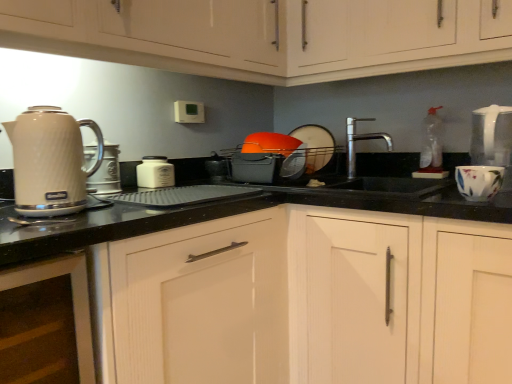
Describe the element at coordinates (183, 195) in the screenshot. I see `black plastic tray at center, acting as the 1th appliance starting from the bottom` at that location.

Find the location of `matte white cabinets at upper left, marked as the first cabinetry in a top-to-bottom arrangement`. matte white cabinets at upper left, marked as the first cabinetry in a top-to-bottom arrangement is located at coordinates (156, 34).

What is the approximate height of polished stainless steel faucet at center?

It is 10.14 inches.

At what (x,y) coordinates should I click in order to perform the action: click on white wood cabinet at center, the 4th cabinetry when ordered from top to bottom. Please return your answer as a coordinate pair (x, y). The image size is (512, 384). Looking at the image, I should click on (306, 300).

Find the location of a particular element. metallic silver toaster at left, which appears as the 1th kitchen appliance when viewed from the front is located at coordinates (106, 173).

Where is `black plastic tray at center, which is the first appliance in front-to-back order`? This screenshot has width=512, height=384. black plastic tray at center, which is the first appliance in front-to-back order is located at coordinates (183, 195).

From a real-world perspective, is black plastic tray at center, which is counted as the 2th appliance, starting from the back, physically below matte white cabinet at upper center, the second cabinetry viewed from the top?

Yes, from a real-world perspective, black plastic tray at center, which is counted as the 2th appliance, starting from the back, is under matte white cabinet at upper center, the second cabinetry viewed from the top.

Is black plastic tray at center, arranged as the second appliance when viewed from the top, completely or partially outside of matte white cabinet at upper center, the third cabinetry from the bottom?

That's correct, black plastic tray at center, arranged as the second appliance when viewed from the top, is outside of matte white cabinet at upper center, the third cabinetry from the bottom.

How different are the orientations of black plastic tray at center, which appears as the 1th appliance when viewed from the left, and matte white cabinet at upper center, the second cabinetry viewed from the top, in degrees?

The facing directions of black plastic tray at center, which appears as the 1th appliance when viewed from the left, and matte white cabinet at upper center, the second cabinetry viewed from the top, are 3.27 degrees apart.

Which is more to the left, black plastic tray at center, acting as the 1th appliance starting from the bottom, or matte white cabinet at upper center, the third cabinetry from the bottom?

Positioned to the left is black plastic tray at center, acting as the 1th appliance starting from the bottom.

Is there a large distance between white matte jar at center, the 2th kitchen appliance when ordered from front to back, and white wood cabinet at center, the 4th cabinetry when ordered from top to bottom?

No, white matte jar at center, the 2th kitchen appliance when ordered from front to back, is in close proximity to white wood cabinet at center, the 4th cabinetry when ordered from top to bottom.

What's the angular difference between white matte jar at center, the first kitchen appliance when ordered from back to front, and white wood cabinet at center, the 4th cabinetry when ordered from top to bottom,'s facing directions?

The angle between the facing direction of white matte jar at center, the first kitchen appliance when ordered from back to front, and the facing direction of white wood cabinet at center, the 4th cabinetry when ordered from top to bottom, is 88.9 degrees.

From a real-world perspective, which is physically below, white matte jar at center, the first kitchen appliance when ordered from back to front, or white wood cabinet at center, placed as the 1th cabinetry when sorted from bottom to top?

white wood cabinet at center, placed as the 1th cabinetry when sorted from bottom to top, from a real-world perspective.

Could you measure the distance between white matte jar at center, which is the 2th kitchen appliance in left-to-right order, and white wood cabinet at center, the 4th cabinetry when ordered from top to bottom?

white matte jar at center, which is the 2th kitchen appliance in left-to-right order, is 28.05 inches from white wood cabinet at center, the 4th cabinetry when ordered from top to bottom.

Is there a large distance between polished stainless steel faucet at center and floral ceramic mug at right?

No, polished stainless steel faucet at center is not far from floral ceramic mug at right.

Which of these two, polished stainless steel faucet at center or floral ceramic mug at right, is wider?

floral ceramic mug at right.

From the picture: From the image's perspective, who appears lower, polished stainless steel faucet at center or floral ceramic mug at right?

From the image's view, floral ceramic mug at right is below.

Does white wood cabinet at lower left, the second cabinetry in the bottom-to-top sequence, have a smaller size compared to white matte jar at center, which is the 2th kitchen appliance in left-to-right order?

No, white wood cabinet at lower left, the second cabinetry in the bottom-to-top sequence, is not smaller than white matte jar at center, which is the 2th kitchen appliance in left-to-right order.

Consider the image. From the image's perspective, which one is positioned lower, white wood cabinet at lower left, which is counted as the 3th cabinetry, starting from the top, or white matte jar at center, the 1th kitchen appliance positioned from the right?

white wood cabinet at lower left, which is counted as the 3th cabinetry, starting from the top, is shown below in the image.

Can you confirm if white wood cabinet at lower left, the second cabinetry in the bottom-to-top sequence, is shorter than white matte jar at center, the 1th kitchen appliance positioned from the right?

In fact, white wood cabinet at lower left, the second cabinetry in the bottom-to-top sequence, may be taller than white matte jar at center, the 1th kitchen appliance positioned from the right.

From a real-world perspective, does white wood cabinet at center, the 4th cabinetry when ordered from top to bottom, sit lower than white wood cabinet at lower left, which is counted as the 3th cabinetry, starting from the top?

Yes.

Can you confirm if white wood cabinet at center, the 4th cabinetry when ordered from top to bottom, is smaller than white wood cabinet at lower left, the second cabinetry in the bottom-to-top sequence?

No, white wood cabinet at center, the 4th cabinetry when ordered from top to bottom, is not smaller than white wood cabinet at lower left, the second cabinetry in the bottom-to-top sequence.

Is white wood cabinet at center, placed as the 1th cabinetry when sorted from bottom to top, taller than white wood cabinet at lower left, the second cabinetry in the bottom-to-top sequence?

Correct, white wood cabinet at center, placed as the 1th cabinetry when sorted from bottom to top, is much taller as white wood cabinet at lower left, the second cabinetry in the bottom-to-top sequence.

Which of these two, white wood cabinet at center, placed as the 1th cabinetry when sorted from bottom to top, or white wood cabinet at lower left, which is counted as the 3th cabinetry, starting from the top, is thinner?

Thinner between the two is white wood cabinet at lower left, which is counted as the 3th cabinetry, starting from the top.

Is metallic silver toaster at left, the second kitchen appliance in the back-to-front sequence, at the back of white wood cabinet at center, placed as the 1th cabinetry when sorted from bottom to top?

No, white wood cabinet at center, placed as the 1th cabinetry when sorted from bottom to top, is not facing away from metallic silver toaster at left, the second kitchen appliance in the back-to-front sequence.

Considering the points (440, 246) and (113, 162), which point is in front, point (440, 246) or point (113, 162)?

Point (440, 246)

This screenshot has height=384, width=512. I want to click on the 2nd kitchen appliance above the white wood cabinet at center, the 4th cabinetry when ordered from top to bottom (from the image's perspective), so click(x=106, y=173).

Is point (335, 66) more distant than point (209, 239)?

Yes.

Considering the relative positions of matte white cabinet at upper center, the third cabinetry from the bottom, and white wood cabinet at center, placed as the 1th cabinetry when sorted from bottom to top, in the image provided, is matte white cabinet at upper center, the third cabinetry from the bottom, to the left of white wood cabinet at center, placed as the 1th cabinetry when sorted from bottom to top, from the viewer's perspective?

Correct, you'll find matte white cabinet at upper center, the third cabinetry from the bottom, to the left of white wood cabinet at center, placed as the 1th cabinetry when sorted from bottom to top.

From the picture: Between matte white cabinet at upper center, the third cabinetry from the bottom, and white wood cabinet at center, placed as the 1th cabinetry when sorted from bottom to top, which one is positioned in front?

matte white cabinet at upper center, the third cabinetry from the bottom.

Is matte white cabinet at upper center, the second cabinetry viewed from the top, turned away from white wood cabinet at center, the 4th cabinetry when ordered from top to bottom?

No, matte white cabinet at upper center, the second cabinetry viewed from the top, is not facing away from white wood cabinet at center, the 4th cabinetry when ordered from top to bottom.

From a real-world perspective, count 1st cabinetrys upward from the black plastic tray at center, which is the first appliance in front-to-back order, and point to it. Please provide its 2D coordinates.

[(264, 35)]

From the image's perspective, starting from the white wood cabinet at center, placed as the 1th cabinetry when sorted from bottom to top, which kitchen appliance is the 1st one above? Please provide its 2D coordinates.

[(155, 172)]

Looking at the image, which one is located closer to matte white cabinets at upper left, the 4th cabinetry positioned from the bottom, polished stainless steel faucet at center or white wood cabinet at lower left, which is counted as the 3th cabinetry, starting from the top?

Among the two, polished stainless steel faucet at center is located nearer to matte white cabinets at upper left, the 4th cabinetry positioned from the bottom.

Based on the photo, based on their spatial positions, is black plastic tray at center, which appears as the 1th appliance when viewed from the left, or floral ceramic mug at right further from matte white kettle at left?

floral ceramic mug at right lies further to matte white kettle at left than the other object.

Which object lies further to the anchor point polished stainless steel faucet at center, white matte jar at center, the 1th kitchen appliance positioned from the right, or floral ceramic mug at right?

Based on the image, white matte jar at center, the 1th kitchen appliance positioned from the right, appears to be further to polished stainless steel faucet at center.

Based on the photo, considering their positions, is white wood cabinet at center, the 4th cabinetry when ordered from top to bottom, positioned further to white matte plate at center, which is the 1th appliance from back to front, than matte white kettle at left?

matte white kettle at left is further to white matte plate at center, which is the 1th appliance from back to front.

Looking at this image, when comparing their distances from matte white cabinet at upper center, the second cabinetry viewed from the top, does polished stainless steel faucet at center or black plastic tray at center, which is the 2th appliance from right to left, seem closer?

Among the two, black plastic tray at center, which is the 2th appliance from right to left, is located nearer to matte white cabinet at upper center, the second cabinetry viewed from the top.

Estimate the real-world distances between objects in this image. Which object is closer to white wood cabinet at center, placed as the 1th cabinetry when sorted from bottom to top, matte white kettle at left or matte white cabinets at upper left, the 4th cabinetry positioned from the bottom?

matte white kettle at left lies closer to white wood cabinet at center, placed as the 1th cabinetry when sorted from bottom to top, than the other object.

Considering their positions, is white wood cabinet at center, the 4th cabinetry when ordered from top to bottom, positioned closer to matte white cabinets at upper left, the 4th cabinetry positioned from the bottom, than white wood cabinet at lower left, which is counted as the 3th cabinetry, starting from the top?

white wood cabinet at center, the 4th cabinetry when ordered from top to bottom, is positioned closer to the anchor matte white cabinets at upper left, the 4th cabinetry positioned from the bottom.

When comparing their distances from matte white kettle at left, does white matte jar at center, the first kitchen appliance when ordered from back to front, or white matte plate at center, which is the 2th appliance in bottom-to-top order, seem further?

white matte plate at center, which is the 2th appliance in bottom-to-top order.

I want to click on home appliance between matte white cabinets at upper left, marked as the first cabinetry in a top-to-bottom arrangement, and white wood cabinet at center, the 4th cabinetry when ordered from top to bottom, in the vertical direction, so click(x=50, y=161).

You are a GUI agent. You are given a task and a screenshot of the screen. Output one action in this format:
    pyautogui.click(x=<x>, y=<y>)
    Task: Click on the kitchen appliance between matte white cabinets at upper left, the 4th cabinetry positioned from the bottom, and matte white kettle at left, in the vertical direction
    This screenshot has width=512, height=384.
    Given the screenshot: What is the action you would take?
    pyautogui.click(x=106, y=173)

Where is `tap positioned between black plastic tray at center, which is the 2th appliance from right to left, and white matte plate at center, which is the 1th appliance from back to front, from near to far`? tap positioned between black plastic tray at center, which is the 2th appliance from right to left, and white matte plate at center, which is the 1th appliance from back to front, from near to far is located at coordinates coord(361,139).

This screenshot has height=384, width=512. Find the location of `kitchen appliance located between matte white kettle at left and polished stainless steel faucet at center in the left-right direction`. kitchen appliance located between matte white kettle at left and polished stainless steel faucet at center in the left-right direction is located at coordinates (155, 172).